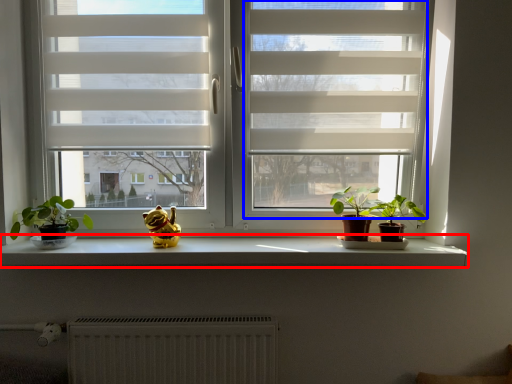
Question: Which point is closer to the camera, window sill (highlighted by a red box) or screen door (highlighted by a blue box)?

Choices:
 (A) window sill
 (B) screen door

Answer: (B)